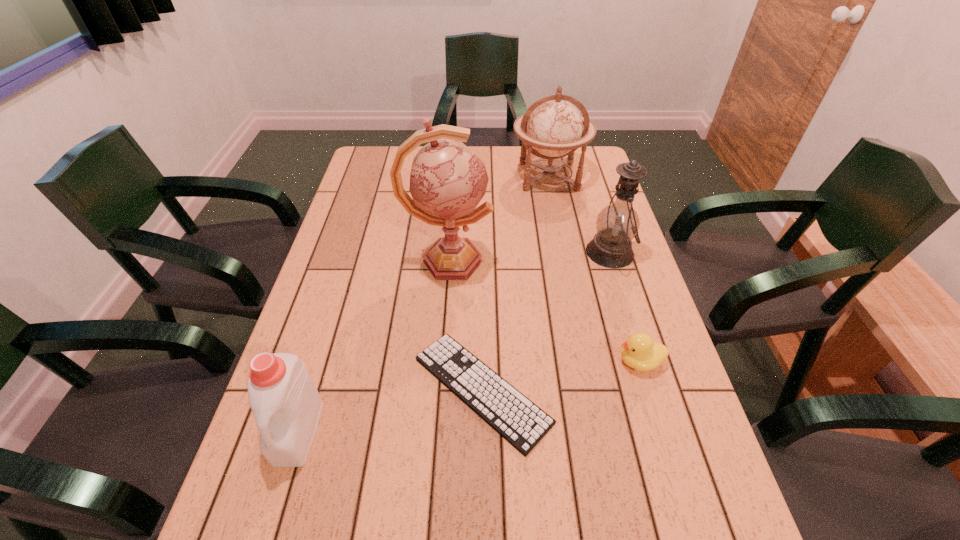
Identify the location of vacant space located 0.400m on the front-facing side of the shorter globe. Image resolution: width=960 pixels, height=540 pixels. (570, 283).

The image size is (960, 540). I want to click on vacant area situated 0.200m on the front of the oil lamp, so click(x=636, y=333).

Where is `vacant space located 0.070m on the handle side of the fourth tallest object`? This screenshot has height=540, width=960. vacant space located 0.070m on the handle side of the fourth tallest object is located at coordinates (275, 509).

Image resolution: width=960 pixels, height=540 pixels. I want to click on blank space located on the beak of the duckling, so click(509, 361).

The image size is (960, 540). In order to click on free space located on the beak of the duckling in this screenshot , I will do `click(539, 361)`.

You are a GUI agent. You are given a task and a screenshot of the screen. Output one action in this format:
    pyautogui.click(x=<x>, y=<y>)
    Task: Click on the free space located 0.190m on the beak of the duckling
    
    Given the screenshot: What is the action you would take?
    pyautogui.click(x=535, y=361)

Find the location of a particular element. Image resolution: width=960 pixels, height=540 pixels. vacant space located 0.240m on the right of the shortest object is located at coordinates (660, 389).

This screenshot has width=960, height=540. Identify the location of object that is at the far edge. (552, 125).

You are a GUI agent. You are given a task and a screenshot of the screen. Output one action in this format:
    pyautogui.click(x=<x>, y=<y>)
    Task: Click on the object located at the left edge
    
    Given the screenshot: What is the action you would take?
    pyautogui.click(x=285, y=402)

Locate an element on the screen. globe situated at the right edge is located at coordinates (552, 125).